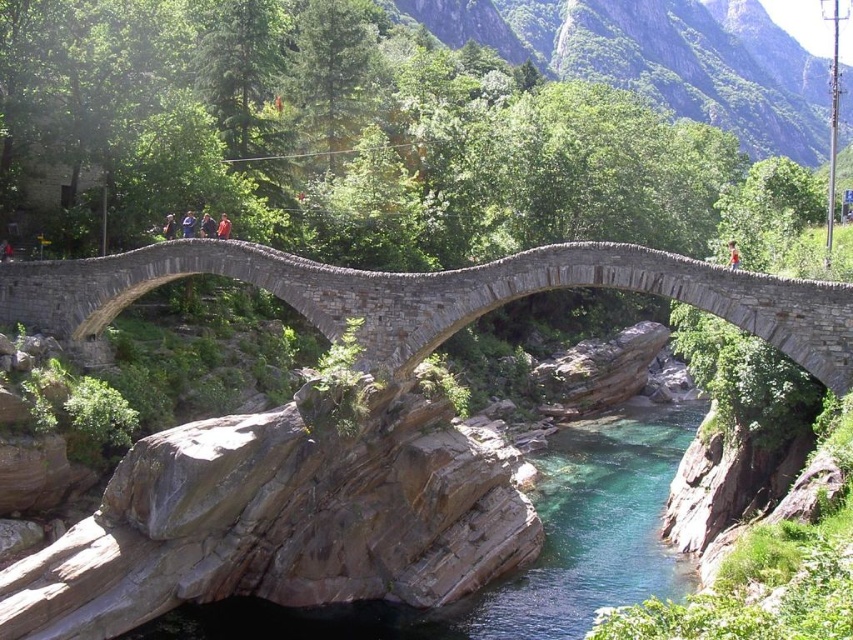
The width and height of the screenshot is (853, 640). In order to click on clear stone river at center in this screenshot , I will do `click(527, 564)`.

Where is `clear stone river at center`? The width and height of the screenshot is (853, 640). clear stone river at center is located at coordinates pos(527,564).

Based on the photo, is gray stone bridge at center to the left of blue fabric shirt at center from the viewer's perspective?

No, gray stone bridge at center is not to the left of blue fabric shirt at center.

Measure the distance between point (746, 314) and camera.

Point (746, 314) and camera are 51.48 meters apart.

Locate an element on the screen. gray stone bridge at center is located at coordinates (436, 296).

This screenshot has height=640, width=853. Identify the location of blue denim jacket at upper center. (189, 225).

Which of these two, blue denim jacket at upper center or dark blue fabric jacket at center, stands taller?

blue denim jacket at upper center

Which is in front, point (189, 227) or point (170, 221)?

Point (189, 227) is more forward.

This screenshot has height=640, width=853. I want to click on blue denim jacket at upper center, so click(189, 225).